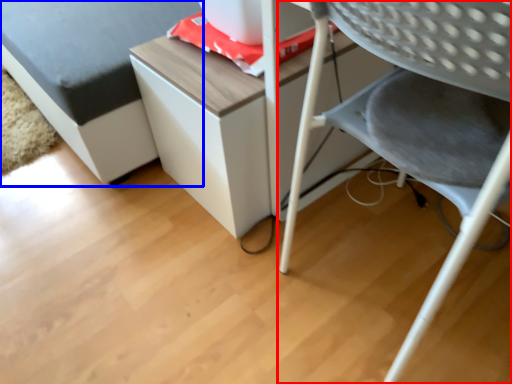
Question: Which object appears farthest to the camera in this image, chair (highlighted by a red box) or furniture (highlighted by a blue box)?

Choices:
 (A) chair
 (B) furniture

Answer: (B)